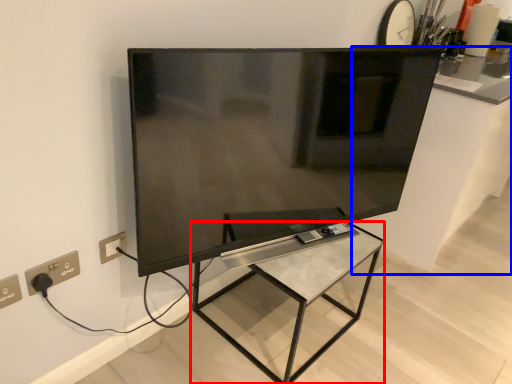
Question: Which point is closer to the camera, furniture (highlighted by a red box) or counter top (highlighted by a blue box)?

Choices:
 (A) furniture
 (B) counter top

Answer: (A)